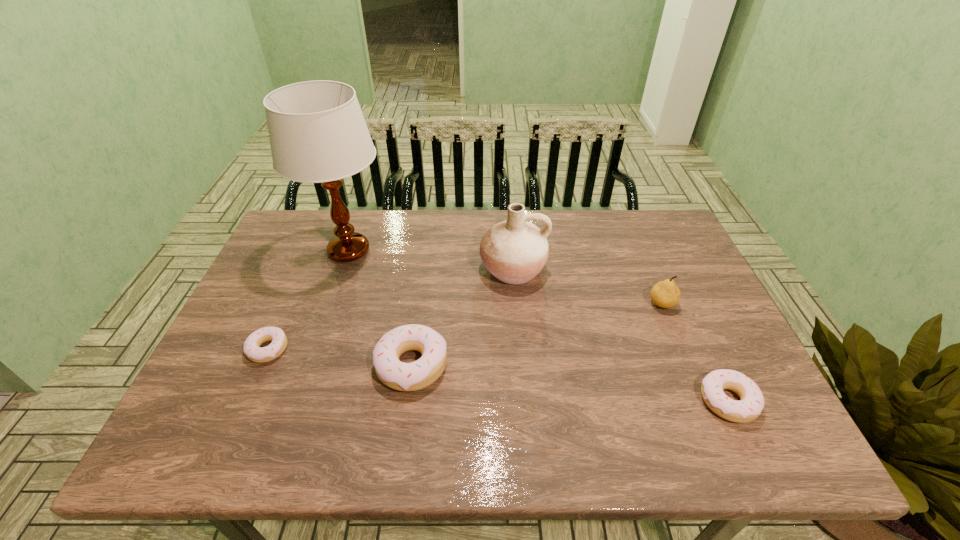
This screenshot has height=540, width=960. I want to click on table lamp at the left edge, so click(x=317, y=132).

At what (x,y) coordinates should I click in order to perform the action: click on doughnut present at the right edge. Please return your answer as a coordinate pair (x, y). Looking at the image, I should click on (751, 403).

Identify the location of pear located at the right edge. This screenshot has width=960, height=540. (665, 294).

Locate an element on the screen. object that is at the far left corner is located at coordinates (317, 132).

The image size is (960, 540). Find the location of `object that is positioned at the near right corner`. object that is positioned at the near right corner is located at coordinates (751, 403).

In the image, there is a desktop. Identify the location of vacant space at the far edge. The width and height of the screenshot is (960, 540). (350, 211).

In the image, there is a desktop. Where is `free space at the near edge`? Image resolution: width=960 pixels, height=540 pixels. free space at the near edge is located at coordinates (274, 396).

Where is `vacant space at the left edge`? Image resolution: width=960 pixels, height=540 pixels. vacant space at the left edge is located at coordinates (298, 275).

In the image, there is a desktop. In order to click on vacant space at the right edge in this screenshot , I will do `click(697, 371)`.

In the image, there is a desktop. Where is `vacant area at the near left corner`? This screenshot has width=960, height=540. vacant area at the near left corner is located at coordinates 228,389.